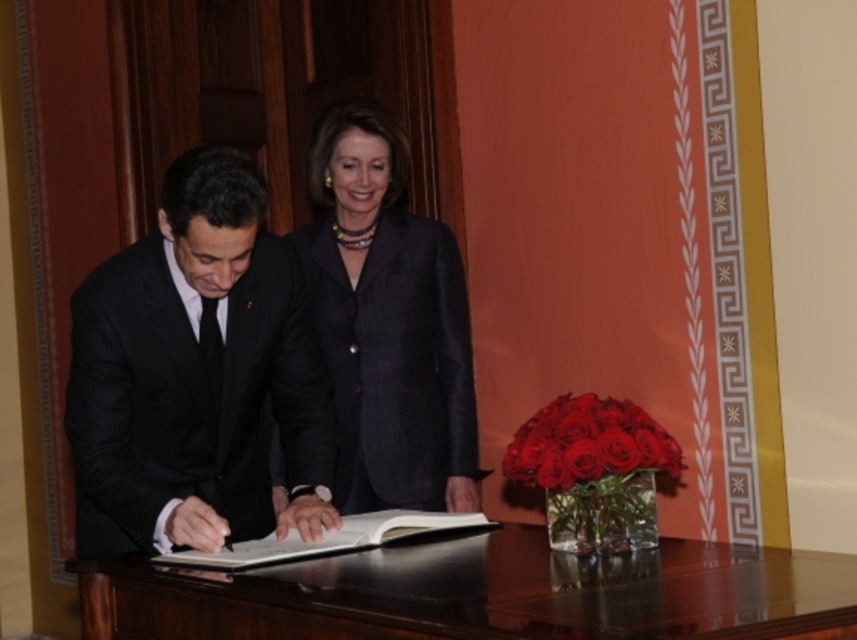
Who is more forward, (222, 582) or (464, 525)?

Point (222, 582)

Who is higher up, shiny dark wood table at center or white paper at center?

white paper at center is higher up.

This screenshot has width=857, height=640. What do you see at coordinates (480, 593) in the screenshot? I see `shiny dark wood table at center` at bounding box center [480, 593].

Identify the location of shiny dark wood table at center. This screenshot has height=640, width=857. (480, 593).

What do you see at coordinates (210, 378) in the screenshot?
I see `black suit at center` at bounding box center [210, 378].

Between black suit at center and shiny red roses at lower right, which one has less height?

With less height is shiny red roses at lower right.

Who is more distant from viewer, (316, 476) or (523, 426)?

The point (316, 476) is more distant.

Where is `black suit at center`? The height and width of the screenshot is (640, 857). black suit at center is located at coordinates (210, 378).

Between point (564, 486) and point (202, 564), which one is positioned behind?

The point (202, 564) is behind.

Measure the distance between point (x=638, y=442) and camera.

2.09 meters

This screenshot has width=857, height=640. Identify the location of shiny red roses at lower right. (586, 442).